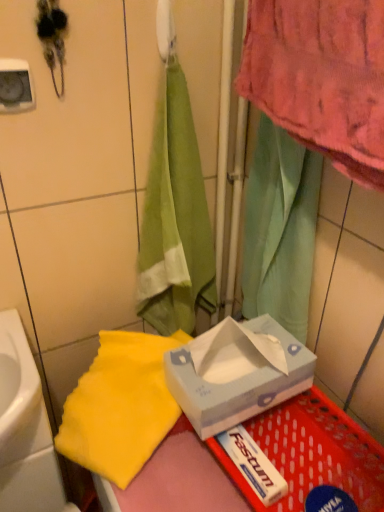
Question: Considering the positions of point (125, 458) and point (28, 393), is point (125, 458) closer or farther from the camera than point (28, 393)?

Choices:
 (A) closer
 (B) farther

Answer: (B)

Question: From their relative heights in the image, would you say yellow fabric towel at lower left is taller or shorter than white glossy sink at lower left?

Choices:
 (A) tall
 (B) short

Answer: (B)

Question: Considering the real-world distances, which object is farthest from the white plastic basket at lower right?

Choices:
 (A) yellow fabric towel at lower left
 (B) white paper tissue box at center
 (C) white glossy sink at lower left

Answer: (C)

Question: Which is nearer to the yellow fabric towel at lower left?

Choices:
 (A) white paper tissue box at center
 (B) white glossy sink at lower left
 (C) white plastic basket at lower right

Answer: (A)